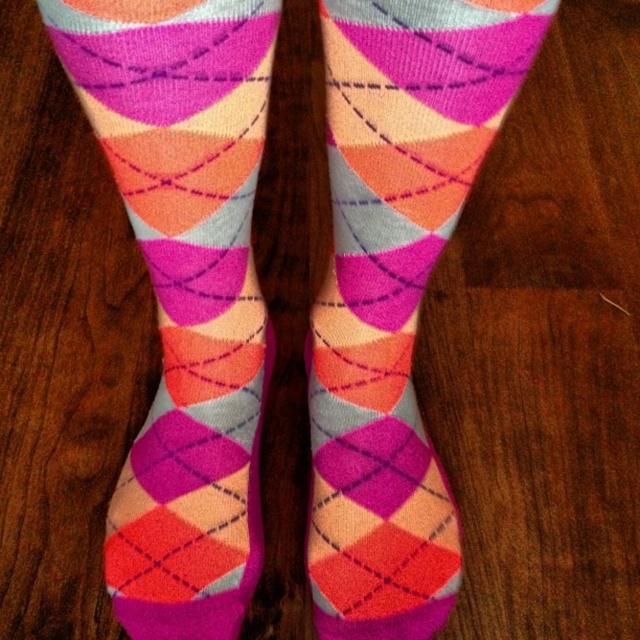
Question: Among these points, which one is farthest from the camera?

Choices:
 (A) (196, 196)
 (B) (308, 548)

Answer: (B)

Question: Which point is closer to the camera?

Choices:
 (A) (228, 90)
 (B) (417, 627)

Answer: (A)

Question: Observing the image, what is the correct spatial positioning of knitted argyle socks at center in reference to matte argyle socks at center?

Choices:
 (A) left
 (B) right

Answer: (A)

Question: Is knitted argyle socks at center positioned behind matte argyle socks at center?

Choices:
 (A) no
 (B) yes

Answer: (A)

Question: Is knitted argyle socks at center to the left of matte argyle socks at center from the viewer's perspective?

Choices:
 (A) no
 (B) yes

Answer: (B)